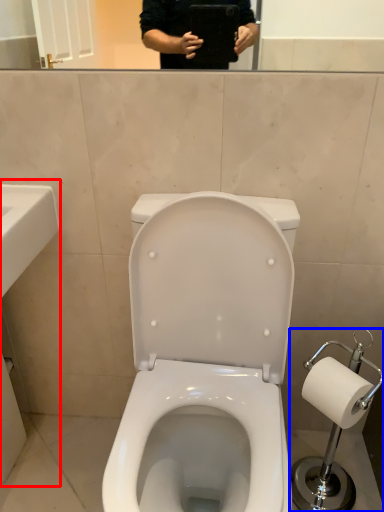
Question: Which point is further to the camera, sink (highlighted by a red box) or scale (highlighted by a blue box)?

Choices:
 (A) sink
 (B) scale

Answer: (B)